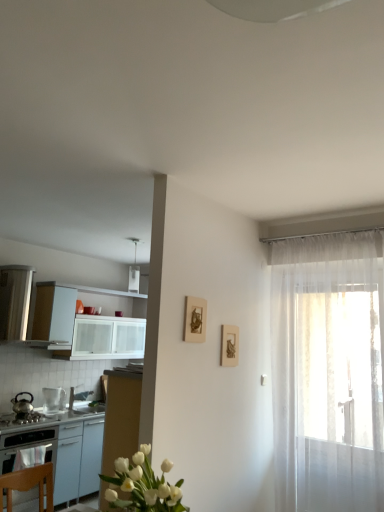
Question: From a real-world perspective, does white glossy sink at lower left sit lower than white glossy table at left?

Choices:
 (A) no
 (B) yes

Answer: (A)

Question: Is white glossy sink at lower left not close to white glossy table at left?

Choices:
 (A) no
 (B) yes

Answer: (A)

Question: Is white glossy sink at lower left to the right of white glossy table at left from the viewer's perspective?

Choices:
 (A) no
 (B) yes

Answer: (B)

Question: Is white glossy table at left at the back of white glossy sink at lower left?

Choices:
 (A) no
 (B) yes

Answer: (A)

Question: Is white glossy sink at lower left surrounding white glossy table at left?

Choices:
 (A) no
 (B) yes

Answer: (A)

Question: Is point (77, 398) positioned closer to the camera than point (364, 376)?

Choices:
 (A) closer
 (B) farther

Answer: (B)

Question: Relative to translucent white curtain at right, is white glossy sink at lower left in front or behind?

Choices:
 (A) behind
 (B) front

Answer: (A)

Question: Is white glossy sink at lower left spatially inside translucent white curtain at right, or outside of it?

Choices:
 (A) inside
 (B) outside

Answer: (B)

Question: Visually, is white glossy sink at lower left positioned to the left or to the right of translucent white curtain at right?

Choices:
 (A) right
 (B) left

Answer: (B)

Question: Is shiny metallic kettle at left, marked as the 1th kitchen appliance in a left-to-right arrangement, wider or thinner than wooden picture frame at center-right, positioned as the first picture frame in back-to-front order?

Choices:
 (A) thin
 (B) wide

Answer: (B)

Question: Is shiny metallic kettle at left, marked as the 1th kitchen appliance in a left-to-right arrangement, taller or shorter than wooden picture frame at center-right, placed as the 2th picture frame when sorted from left to right?

Choices:
 (A) tall
 (B) short

Answer: (B)

Question: From the image's perspective, is shiny metallic kettle at left, which ranks as the second kitchen appliance in right-to-left order, positioned above or below wooden picture frame at center-right, placed as the 2th picture frame when sorted from left to right?

Choices:
 (A) below
 (B) above

Answer: (A)

Question: Is shiny metallic kettle at left, which ranks as the second kitchen appliance in right-to-left order, in front of or behind wooden picture frame at center-right, placed as the 2th picture frame when sorted from left to right, in the image?

Choices:
 (A) behind
 (B) front

Answer: (A)

Question: From a real-world perspective, relative to wooden picture frame at center-right, placed as the 2th picture frame when sorted from left to right, is matte gold picture frame at upper center, which is the 1th picture frame in front-to-back order, vertically above or below?

Choices:
 (A) below
 (B) above

Answer: (B)

Question: Based on their positions, is matte gold picture frame at upper center, arranged as the first picture frame when viewed from the left, located to the left or right of wooden picture frame at center-right, which is counted as the 2th picture frame, starting from the front?

Choices:
 (A) right
 (B) left

Answer: (B)